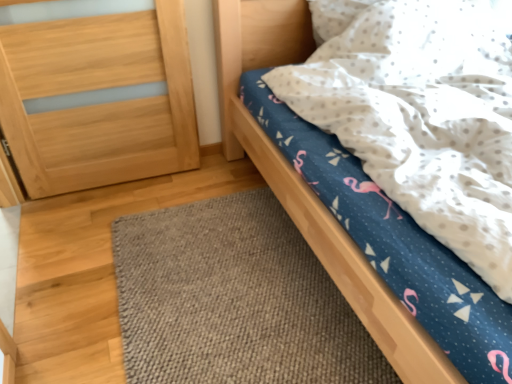
Question: From their relative heights in the image, would you say blue fabric bed at upper right is taller or shorter than brown woven mat at lower center?

Choices:
 (A) short
 (B) tall

Answer: (B)

Question: Considering the relative positions of blue fabric bed at upper right and brown woven mat at lower center in the image provided, is blue fabric bed at upper right to the left or to the right of brown woven mat at lower center?

Choices:
 (A) right
 (B) left

Answer: (A)

Question: Which is nearer to the light brown wood at left?

Choices:
 (A) blue fabric bed at upper right
 (B) brown woven mat at lower center

Answer: (A)

Question: Estimate the real-world distances between objects in this image. Which object is closer to the light brown wood at left?

Choices:
 (A) brown woven mat at lower center
 (B) blue fabric bed at upper right

Answer: (B)